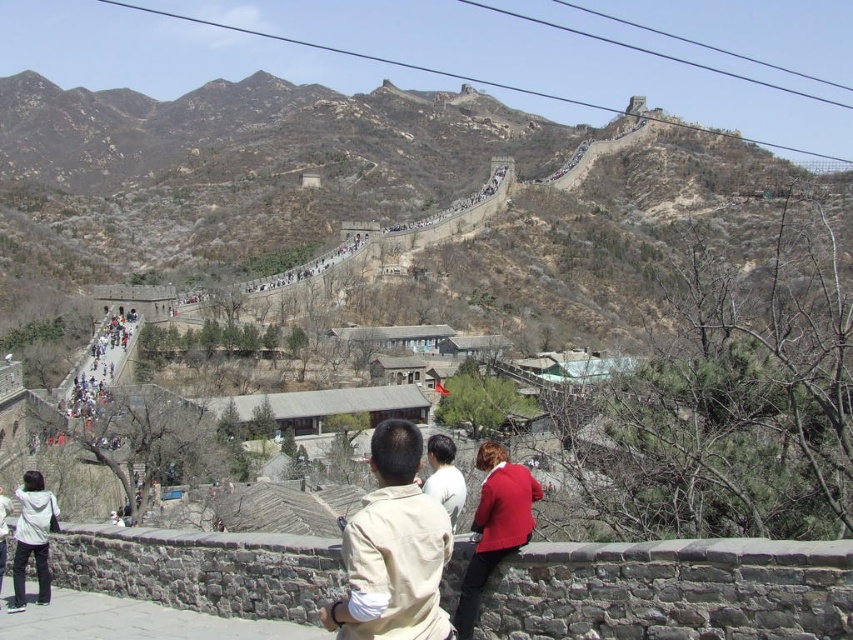
You are standing on the Great Wall of China and see two points marked on the wall. The first point is located at coordinates point (27,528) and the second at point (456,506). Which point is closer to you?

Point (27,528) is further to the camera than point (456,506), so the point closer to you is point (456,506).

You are a photographer standing on the Great Wall of China and want to capture a photo of two tourists wearing a beige fabric shirt at center and a red matte jacket at center. If your camera has a maximum focus range of 6 meters, will both tourists be in focus?

The beige fabric shirt at center is 6.14 meters from the red matte jacket at center. Since the camera can only focus up to 6 meters, the distance between them exceeds the maximum range. Therefore, both tourists might not be in focus simultaneously.